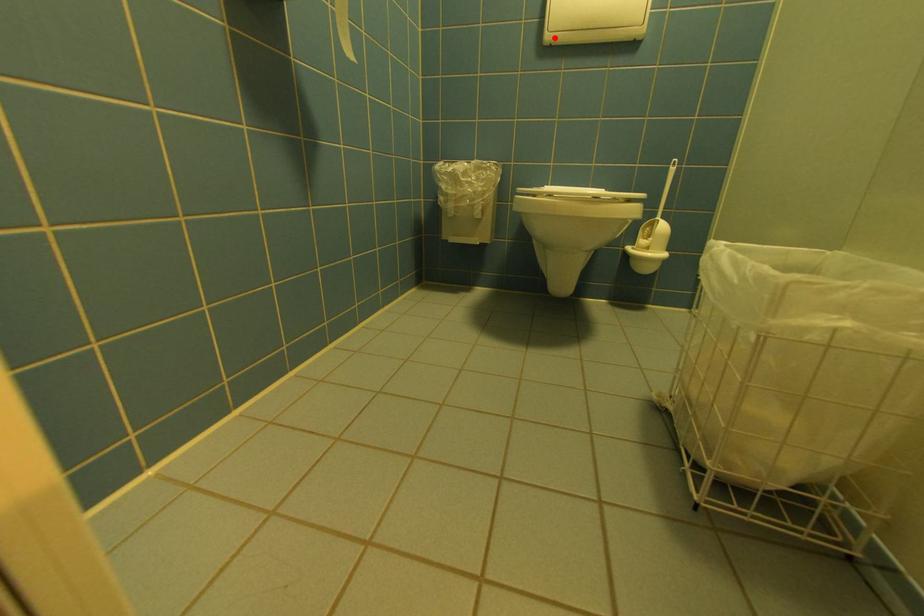
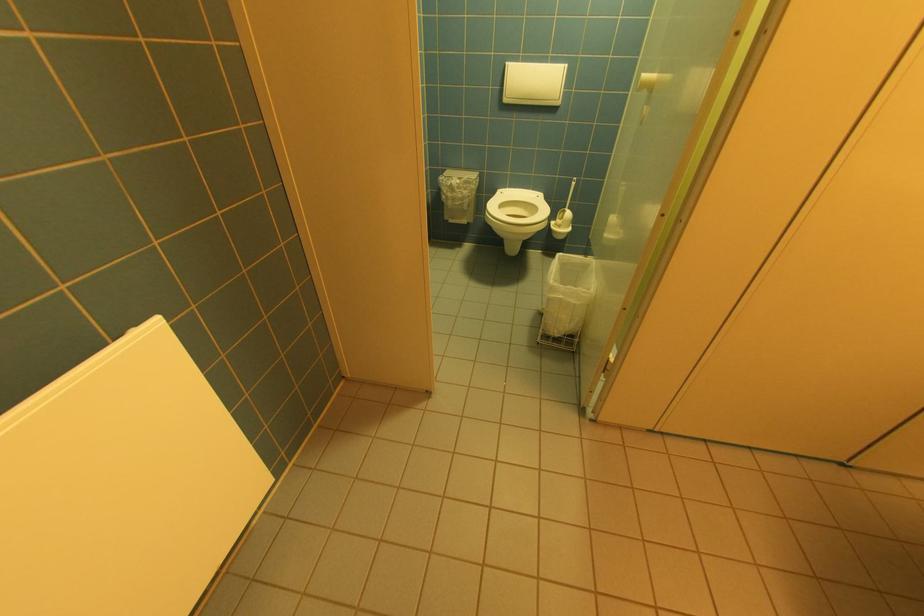
The point at the highlighted location is marked in the first image. Where is the corresponding point in the second image?

(512, 100)